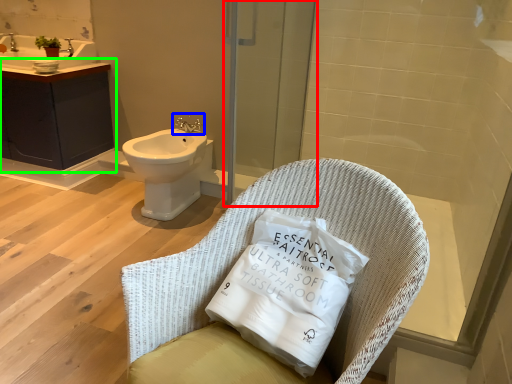
Question: Based on their relative distances, which object is nearer to screen door (highlighted by a red box)? Choose from tap (highlighted by a blue box) and bathroom cabinet (highlighted by a green box).

Choices:
 (A) tap
 (B) bathroom cabinet

Answer: (A)